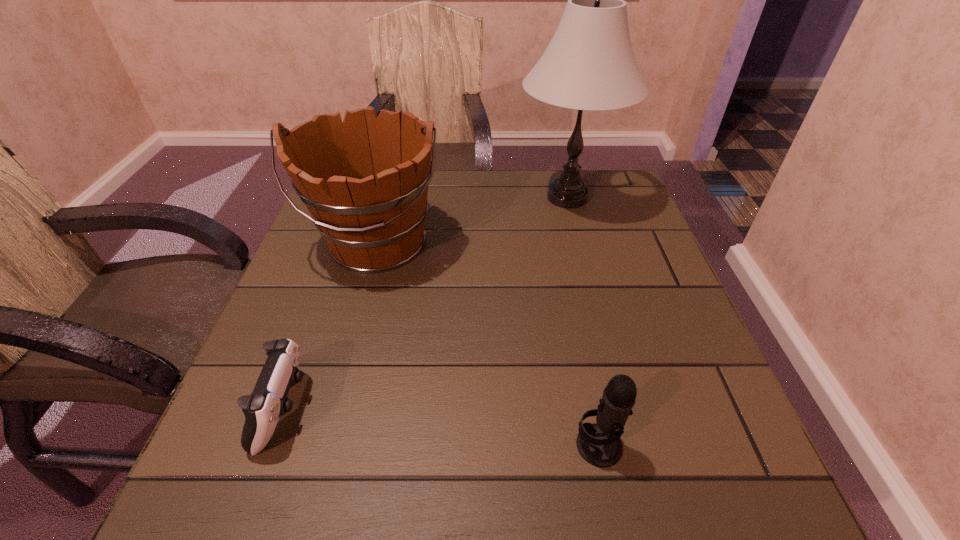
This screenshot has height=540, width=960. Identify the location of microphone that is at the near edge. (599, 444).

Find the location of a particular element. The image size is (960, 540). control at the near edge is located at coordinates (268, 401).

Where is `wine bucket present at the left edge`? This screenshot has height=540, width=960. wine bucket present at the left edge is located at coordinates (365, 181).

Where is `control at the left edge`? control at the left edge is located at coordinates (268, 401).

Identify the location of object that is at the right edge. The height and width of the screenshot is (540, 960). (589, 64).

Where is `object present at the far left corner`? This screenshot has height=540, width=960. object present at the far left corner is located at coordinates click(x=365, y=181).

Find the location of a particular element. object at the near left corner is located at coordinates (268, 401).

The image size is (960, 540). Find the location of `object that is at the far right corner`. object that is at the far right corner is located at coordinates (589, 64).

Find the location of a particular element. The height and width of the screenshot is (540, 960). blank space at the far edge of the desktop is located at coordinates (485, 170).

At what (x,y) coordinates should I click in order to perform the action: click on free space at the near edge of the desktop. Please return your answer as a coordinate pair (x, y). The image size is (960, 540). Looking at the image, I should click on (555, 504).